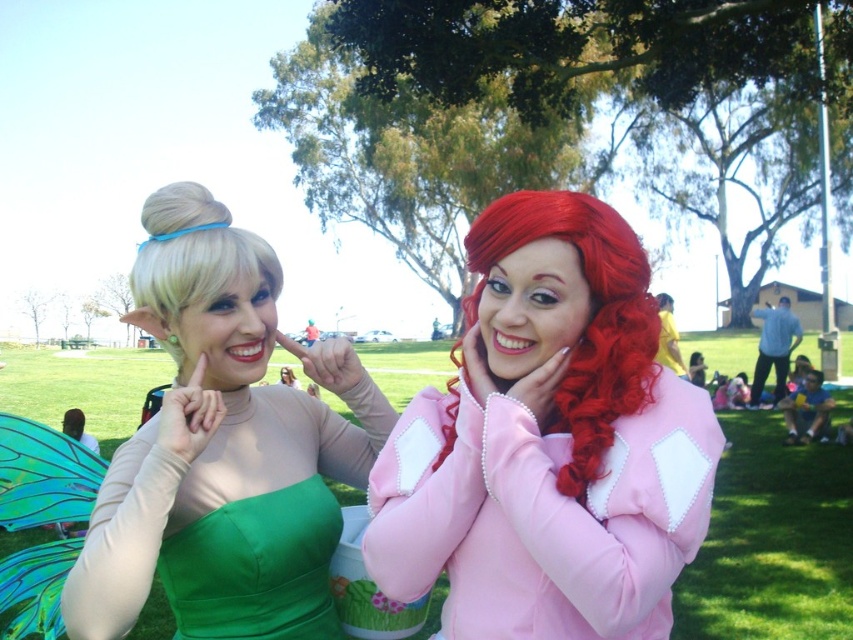
Question: Which point is farther to the camera?

Choices:
 (A) (155, 228)
 (B) (634, 292)
 (C) (289, 628)
 (D) (254, 486)

Answer: (D)

Question: Is curly matte red hair at center positioned in front of blonde silky hair at upper left?

Choices:
 (A) no
 (B) yes

Answer: (B)

Question: Does green satin dress at left have a greater width compared to blonde silky hair at upper left?

Choices:
 (A) no
 (B) yes

Answer: (B)

Question: Among these objects, which one is farthest from the camera?

Choices:
 (A) curly matte red hair at center
 (B) green satin dress at center
 (C) satin pink dress at center
 (D) green satin dress at left

Answer: (B)

Question: Is satin pink dress at center bigger than green satin dress at center?

Choices:
 (A) no
 (B) yes

Answer: (B)

Question: Considering the real-world distances, which object is farthest from the green satin dress at center?

Choices:
 (A) curly matte red hair at center
 (B) satin pink dress at center

Answer: (A)